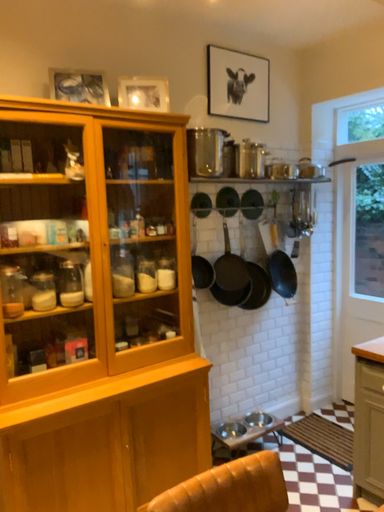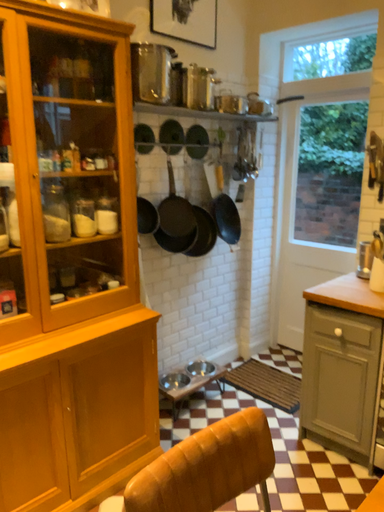
Question: Which way did the camera rotate in the video?

Choices:
 (A) rotated right
 (B) rotated left

Answer: (A)